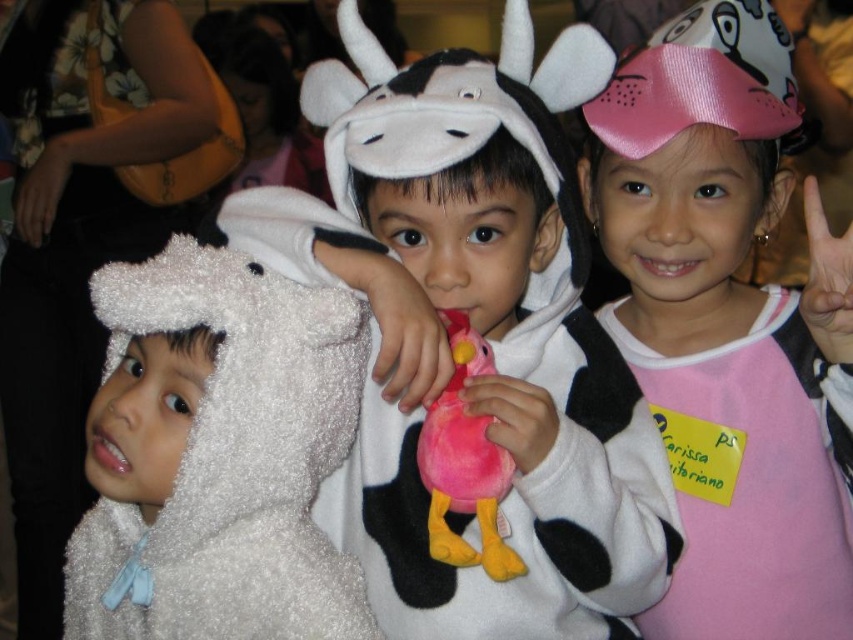
You are a photographer at the event and want to capture a photo of the fluffy white costume at center and the pink plush toy at center. If you want to ensure both are fully visible in the frame, which object should you position closer to the camera to avoid cropping?

The fluffy white costume at center is wider than the pink plush toy at center, so positioning the fluffy white costume at center closer to the camera will ensure it fits within the frame without cropping.

You are a photographer trying to capture the best angle of the children. You notice two points marked in the image at coordinates point (529, 456) and point (790, 593). Which point is closer to you, the photographer?

Point (529, 456) is closer to the viewer than point (790, 593).